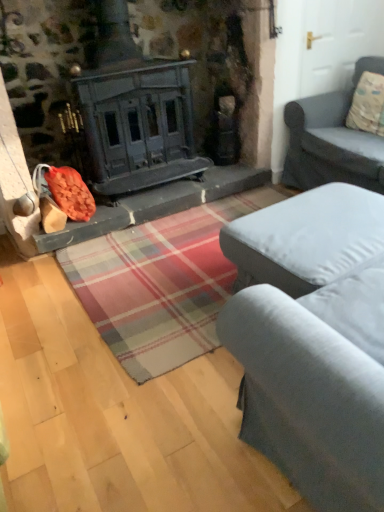
Question: From a real-world perspective, does gray fabric couch at right, placed as the 2th studio couch when sorted from front to back, sit lower than fluffy beige pillow at upper right?

Choices:
 (A) yes
 (B) no

Answer: (A)

Question: From the image's perspective, is gray fabric couch at right, placed as the 2th studio couch when sorted from front to back, located above fluffy beige pillow at upper right?

Choices:
 (A) no
 (B) yes

Answer: (A)

Question: Can you confirm if gray fabric couch at right, acting as the 2th studio couch starting from the bottom, is positioned to the left of fluffy beige pillow at upper right?

Choices:
 (A) yes
 (B) no

Answer: (A)

Question: Can you confirm if gray fabric couch at right, the 1th studio couch viewed from the top, is taller than fluffy beige pillow at upper right?

Choices:
 (A) yes
 (B) no

Answer: (A)

Question: Is gray fabric couch at right, the 1th studio couch viewed from the top, further to the viewer compared to fluffy beige pillow at upper right?

Choices:
 (A) no
 (B) yes

Answer: (A)

Question: Is gray fabric couch at right, which is the 1th studio couch in back-to-front order, spatially inside fluffy beige pillow at upper right, or outside of it?

Choices:
 (A) inside
 (B) outside

Answer: (B)

Question: In the image, is gray fabric couch at right, the 1th studio couch viewed from the top, on the left side or the right side of fluffy beige pillow at upper right?

Choices:
 (A) right
 (B) left

Answer: (B)

Question: From their relative heights in the image, would you say gray fabric couch at right, the 1th studio couch viewed from the top, is taller or shorter than fluffy beige pillow at upper right?

Choices:
 (A) tall
 (B) short

Answer: (A)

Question: Looking at the image, does gray fabric couch at right, which is the 1th studio couch in back-to-front order, seem bigger or smaller compared to fluffy beige pillow at upper right?

Choices:
 (A) small
 (B) big

Answer: (B)

Question: From the image's perspective, is fluffy beige pillow at upper right located above or below gray fabric couch at right, the 1th studio couch viewed from the top?

Choices:
 (A) below
 (B) above

Answer: (B)

Question: Would you say fluffy beige pillow at upper right is to the left or to the right of gray fabric couch at right, placed as the 2th studio couch when sorted from front to back, in the picture?

Choices:
 (A) left
 (B) right

Answer: (B)

Question: From a real-world perspective, is fluffy beige pillow at upper right positioned above or below gray fabric couch at right, which is the 1th studio couch in back-to-front order?

Choices:
 (A) below
 (B) above

Answer: (B)

Question: From their relative heights in the image, would you say fluffy beige pillow at upper right is taller or shorter than gray fabric couch at right, the 1th studio couch viewed from the top?

Choices:
 (A) short
 (B) tall

Answer: (A)

Question: Visually, is gray fabric couch at right, which is the 1th studio couch in back-to-front order, positioned to the left or to the right of gray fabric ottoman at center, positioned as the second studio couch in back-to-front order?

Choices:
 (A) right
 (B) left

Answer: (A)

Question: In the image, is gray fabric couch at right, placed as the 2th studio couch when sorted from front to back, positioned in front of or behind gray fabric ottoman at center, the 2th studio couch positioned from the top?

Choices:
 (A) front
 (B) behind

Answer: (B)